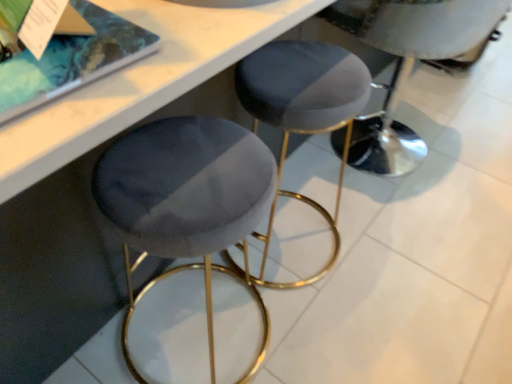
Question: Considering the relative sizes of velvet grey stool at center and velvet grey stool at center in the image provided, is velvet grey stool at center bigger than velvet grey stool at center?

Choices:
 (A) no
 (B) yes

Answer: (B)

Question: Considering the relative positions of velvet grey stool at center and velvet grey stool at center in the image provided, is velvet grey stool at center behind velvet grey stool at center?

Choices:
 (A) yes
 (B) no

Answer: (A)

Question: Would you say velvet grey stool at center contains velvet grey stool at center?

Choices:
 (A) no
 (B) yes

Answer: (A)

Question: Is velvet grey stool at center wider than velvet grey stool at center?

Choices:
 (A) no
 (B) yes

Answer: (B)

Question: Considering the relative sizes of velvet grey stool at center and velvet grey stool at center in the image provided, is velvet grey stool at center shorter than velvet grey stool at center?

Choices:
 (A) no
 (B) yes

Answer: (A)

Question: Could you tell me if velvet grey stool at center is turned towards velvet grey stool at center?

Choices:
 (A) yes
 (B) no

Answer: (B)

Question: Is velvet grey stool at center thinner than velvet grey stool at center?

Choices:
 (A) yes
 (B) no

Answer: (A)

Question: Is velvet grey stool at center to the left of velvet grey stool at center from the viewer's perspective?

Choices:
 (A) no
 (B) yes

Answer: (B)

Question: Does velvet grey stool at center lie behind velvet grey stool at center?

Choices:
 (A) no
 (B) yes

Answer: (A)

Question: Considering the relative positions of velvet grey stool at center and velvet grey stool at center in the image provided, is velvet grey stool at center to the right of velvet grey stool at center from the viewer's perspective?

Choices:
 (A) yes
 (B) no

Answer: (B)

Question: Considering the relative sizes of velvet grey stool at center and velvet grey stool at center in the image provided, is velvet grey stool at center wider than velvet grey stool at center?

Choices:
 (A) yes
 (B) no

Answer: (B)

Question: From a real-world perspective, is velvet grey stool at center physically below velvet grey stool at center?

Choices:
 (A) no
 (B) yes

Answer: (B)

Question: From the image's perspective, is velvet grey stool at center positioned above or below velvet grey stool at center?

Choices:
 (A) above
 (B) below

Answer: (A)